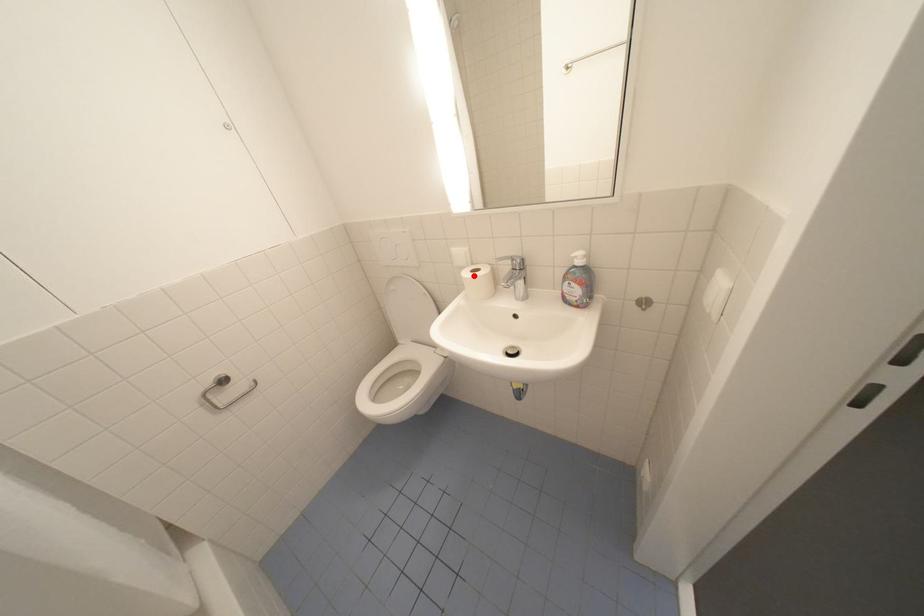
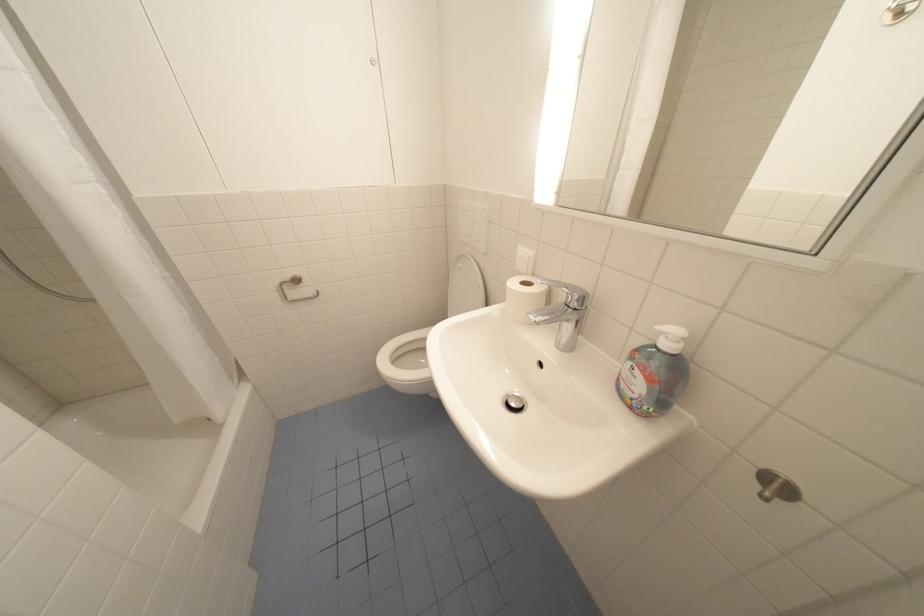
Locate, in the second image, the point that corresponds to the highlighted location in the first image.

(520, 284)